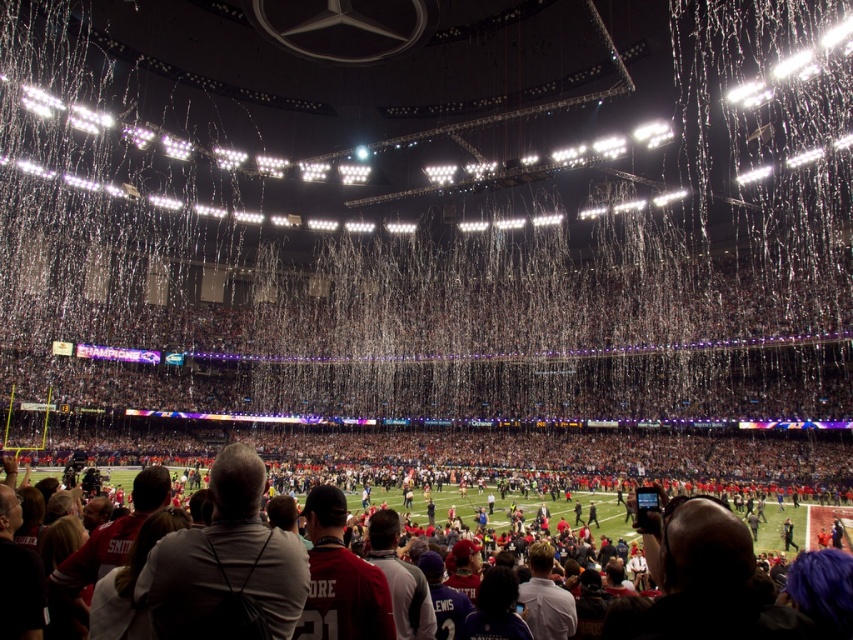
You are a photographer standing at the edge of the stadium field. You want to take a photo of the red jersey football team at lower center without the white paper confetti at center blocking the view. Is this possible given their positions?

The white paper confetti at center is further to the viewer than the red jersey football team at lower center, so the confetti would appear in front of the team in the photo, making it impossible to capture the team without the confetti obstructing the view.

You are a photographer positioned at the center of the stadium trying to capture the white paper confetti at center. Based on its position, will your camera, which is aimed directly at the center of the stadium, capture the confetti?

The white paper confetti at center is located at point [445,243], which is very close to the center of the stadium. Therefore, the camera aimed directly at the center will likely capture the confetti.